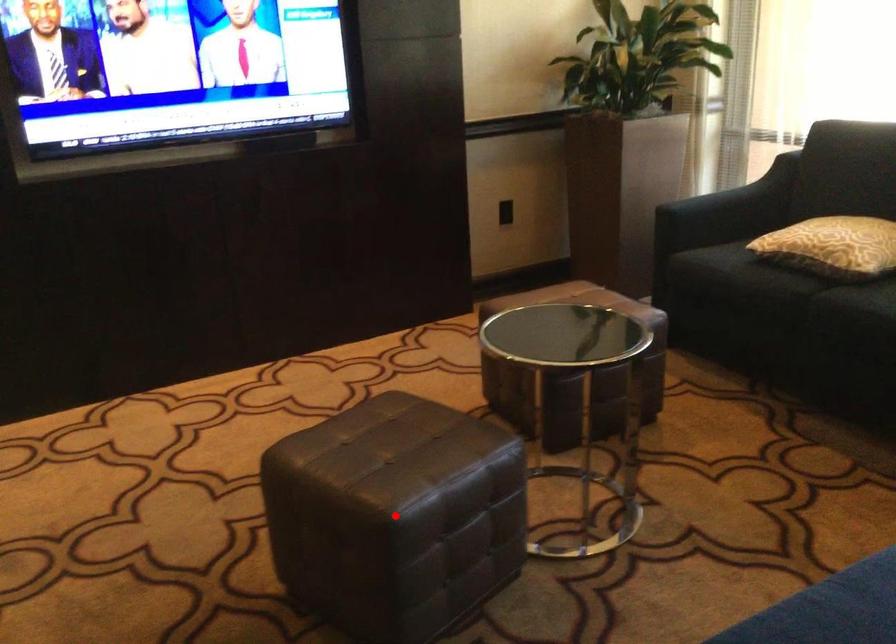
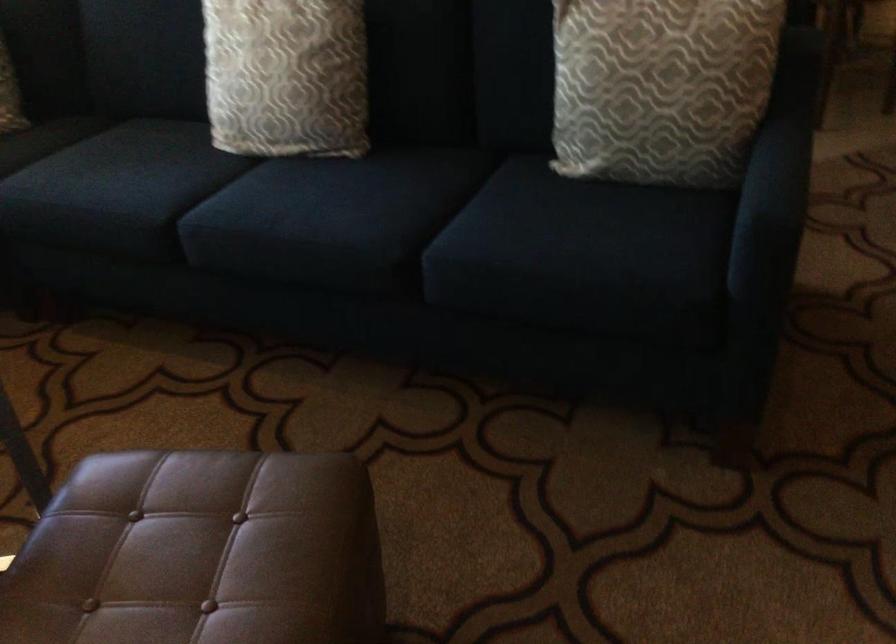
Question: I am providing you with two images of the same scene from different viewpoints. Image1 has a red point marked. In image2, the corresponding 3D location appears at what relative position? Reply with the corresponding letter.

Choices:
 (A) Closer
 (B) Farther

Answer: (B)